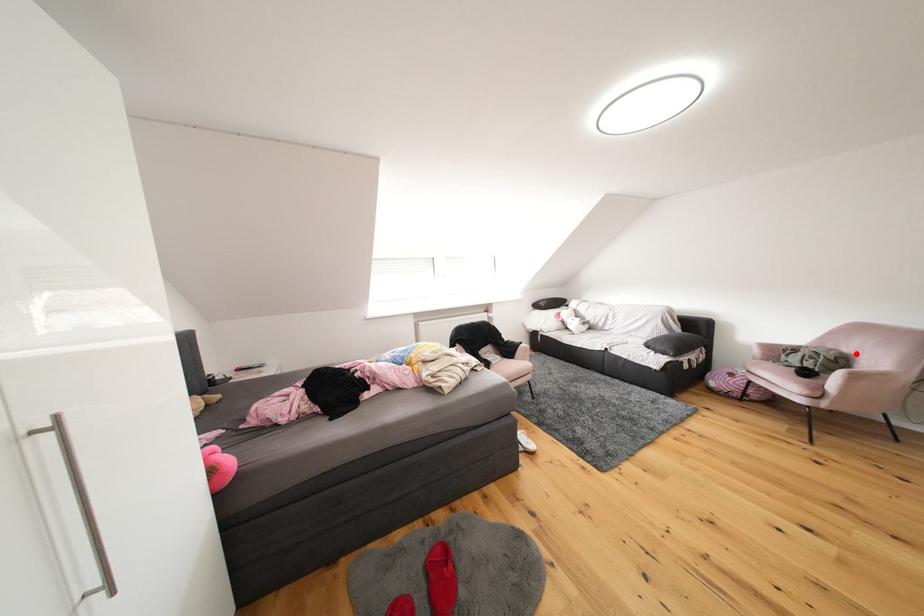
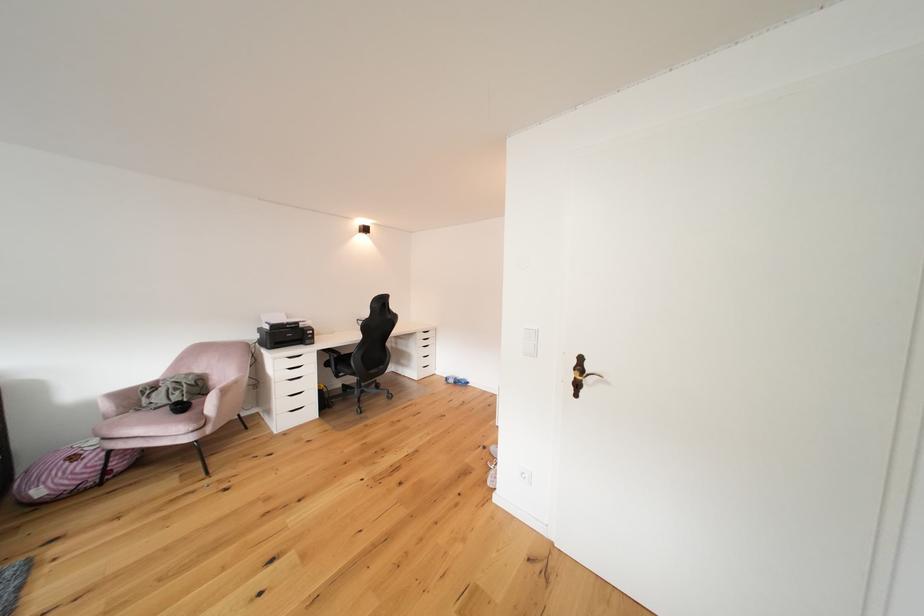
Question: I am providing you with two images of the same scene from different viewpoints. Given a red point in image1, look at the same physical point in image2. Is it:

Choices:
 (A) Closer to the viewpoint
 (B) Farther from the viewpoint

Answer: (A)